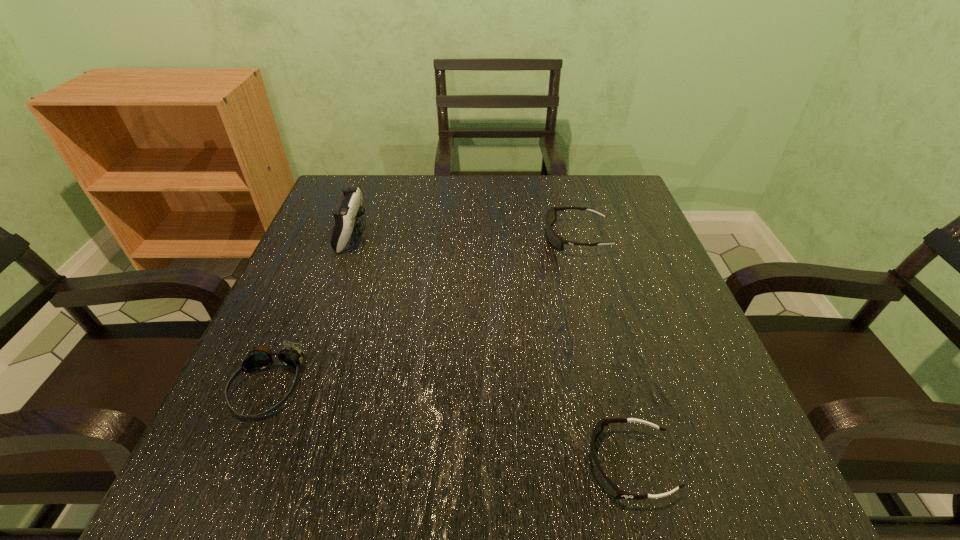
This screenshot has width=960, height=540. In order to click on object at the far right corner in this screenshot , I will do click(555, 240).

Where is `object that is at the near right corner`? The image size is (960, 540). object that is at the near right corner is located at coordinates (612, 489).

This screenshot has height=540, width=960. Find the location of `vacant space at the far edge of the desktop`. vacant space at the far edge of the desktop is located at coordinates (438, 176).

Locate an element on the screen. The image size is (960, 540). free region at the near edge is located at coordinates (340, 474).

Where is `vacant space at the left edge of the desktop`? The image size is (960, 540). vacant space at the left edge of the desktop is located at coordinates (274, 326).

Locate an element on the screen. free region at the right edge of the desktop is located at coordinates (672, 286).

Where is `free space at the far left corner of the desktop`? The image size is (960, 540). free space at the far left corner of the desktop is located at coordinates (337, 204).

Find the location of a particular element. This screenshot has height=540, width=960. vacant area at the near left corner of the desktop is located at coordinates (196, 474).

Locate an element on the screen. The image size is (960, 540). vacant space at the far right corner of the desktop is located at coordinates (579, 177).

The image size is (960, 540). I want to click on free space at the near right corner of the desktop, so click(718, 451).